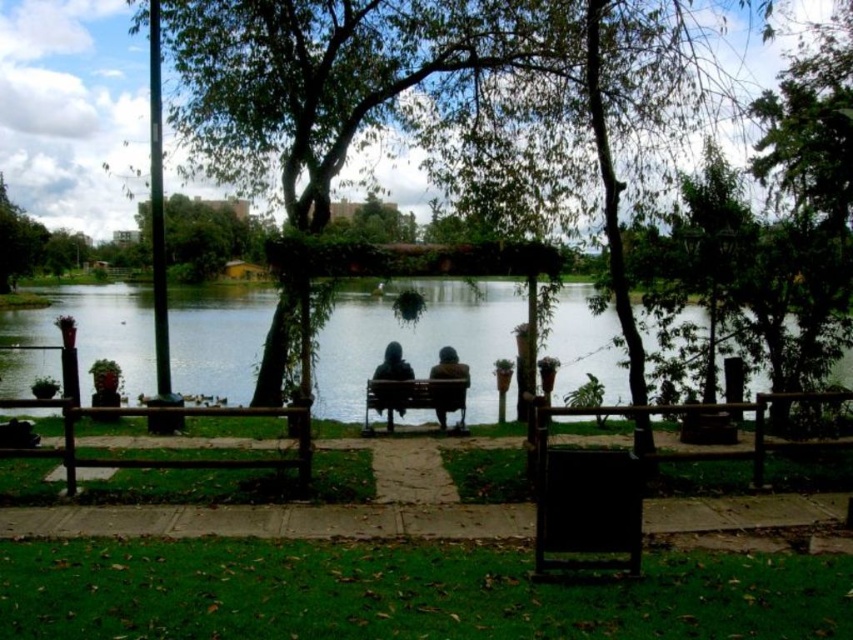
Question: Which point is farther from the camera taking this photo?

Choices:
 (A) (436, 408)
 (B) (241, 84)
 (C) (328, 353)
 (D) (310, 465)

Answer: (C)

Question: Does green leafy tree at center have a smaller size compared to brown wooden bench at center?

Choices:
 (A) no
 (B) yes

Answer: (A)

Question: Can you confirm if dark brown leather bench at center is positioned to the left of dark green hooded jacket at center?

Choices:
 (A) no
 (B) yes

Answer: (A)

Question: Does dark brown leather bench at center appear over dark green hooded jacket at center?

Choices:
 (A) no
 (B) yes

Answer: (A)

Question: Which point appears farthest from the camera in this image?

Choices:
 (A) (563, 385)
 (B) (498, 90)

Answer: (B)

Question: Among these objects, which one is nearest to the camera?

Choices:
 (A) dark green hooded jacket at center
 (B) dark brown leather bench at center
 (C) transparent glass lake at center

Answer: (C)